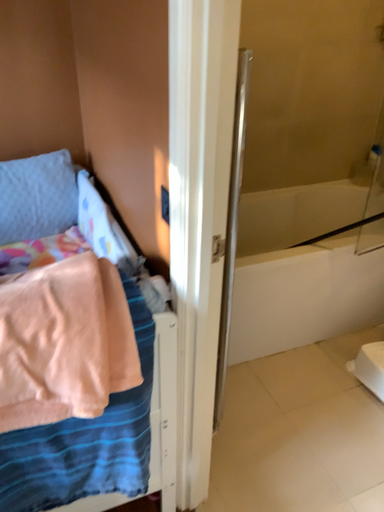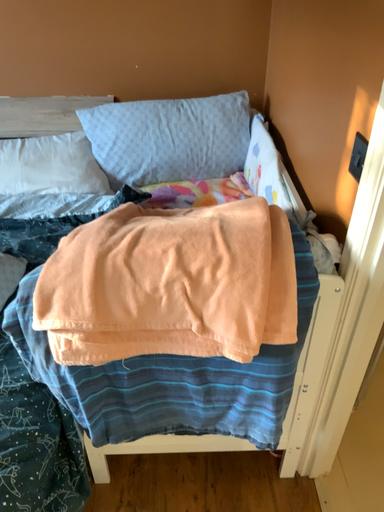
Question: Which way did the camera rotate in the video?

Choices:
 (A) rotated left
 (B) rotated right

Answer: (A)